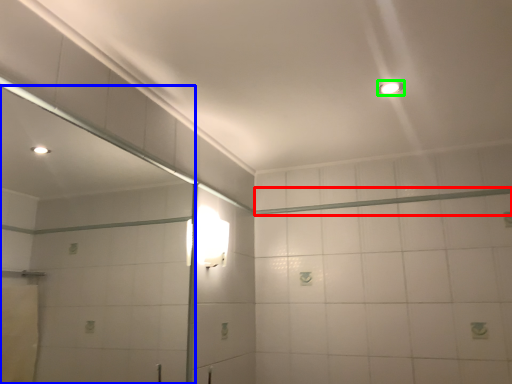
Question: Based on their relative distances, which object is farther from beam (highlighted by a red box)? Choose from mirror (highlighted by a blue box) and light fixture (highlighted by a green box).

Choices:
 (A) mirror
 (B) light fixture

Answer: (A)